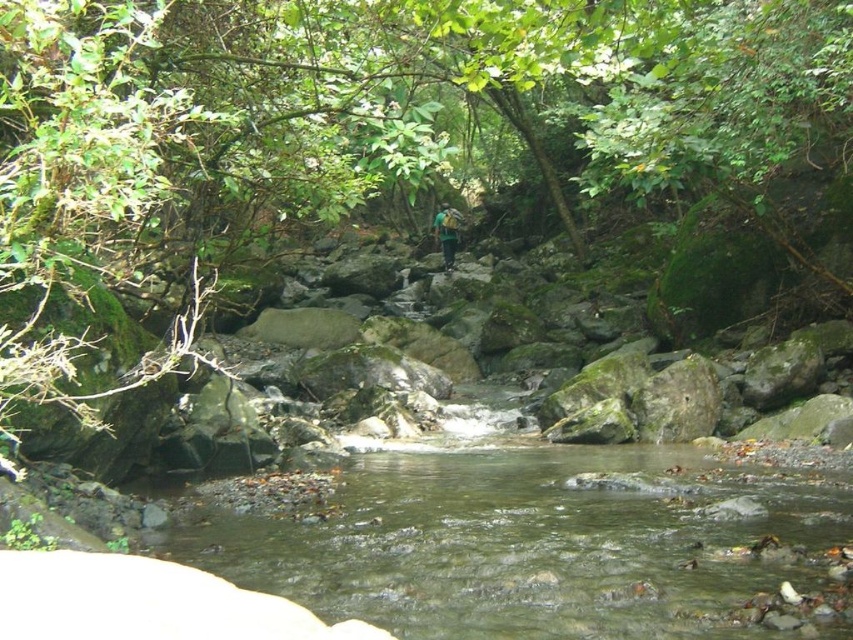
You are standing at the edge of the stream and want to cross to the other side. The clear water at center is flowing gently. How far apart are the two banks of the stream?

The two banks of the stream are 5.35 meters apart.